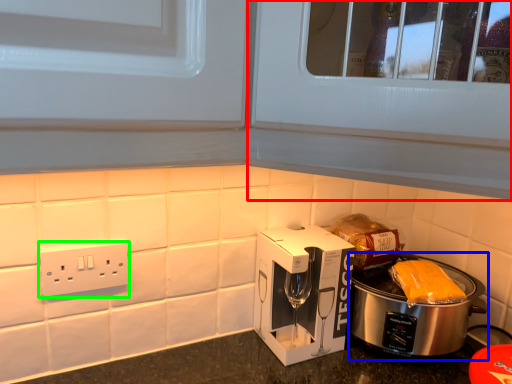
Question: Considering the real-world distances, which object is closest to glass door (highlighted by a red box)? slow cooker (highlighted by a blue box) or power plugs and sockets (highlighted by a green box).

Choices:
 (A) slow cooker
 (B) power plugs and sockets

Answer: (A)